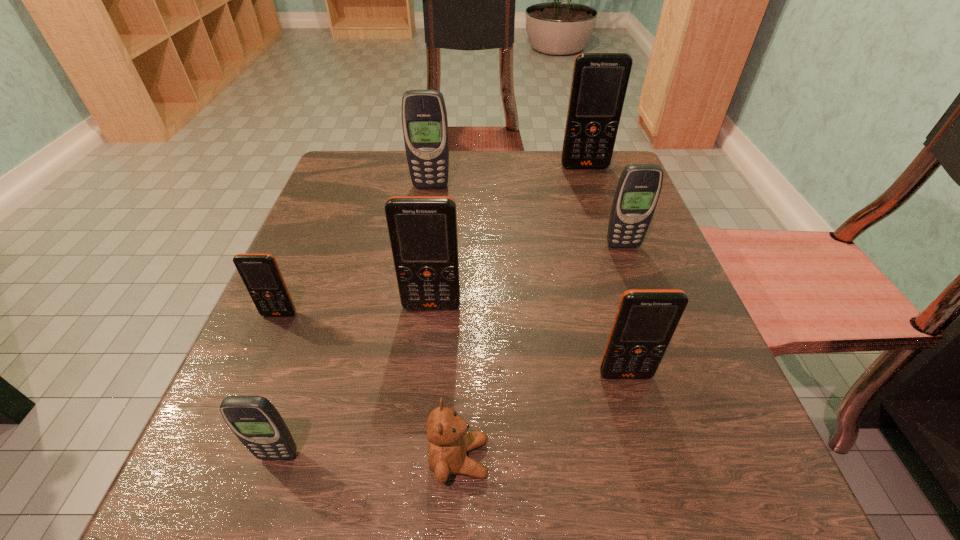
Find the location of `the leftmost cellular telephone`. the leftmost cellular telephone is located at coordinates (260, 273).

Find the location of a particular element. The image size is (960, 540). the nearest cellular telephone is located at coordinates (255, 421).

Identify the location of the nearest gray cellular telephone. (255, 421).

At what (x,y) coordinates should I click in order to perform the action: click on teddy bear. Please return your answer as a coordinate pair (x, y). The width and height of the screenshot is (960, 540). Looking at the image, I should click on (449, 441).

Locate an element on the screen. This screenshot has height=540, width=960. brown teddy bear is located at coordinates (449, 441).

The height and width of the screenshot is (540, 960). Find the location of `vacant area situated 0.160m on the screen of the tallest object`. vacant area situated 0.160m on the screen of the tallest object is located at coordinates 598,208.

You are a GUI agent. You are given a task and a screenshot of the screen. Output one action in this format:
    pyautogui.click(x=<x>, y=<y>)
    Task: Click on the free space located 0.190m on the screen of the third smallest orange cellular telephone
    
    Given the screenshot: What is the action you would take?
    pyautogui.click(x=420, y=413)

This screenshot has height=540, width=960. Find the location of `free space located on the screen of the biggest gray cellular telephone`. free space located on the screen of the biggest gray cellular telephone is located at coordinates (421, 251).

Where is `vacant space located 0.290m on the screen of the rightmost gray cellular telephone`? The height and width of the screenshot is (540, 960). vacant space located 0.290m on the screen of the rightmost gray cellular telephone is located at coordinates (668, 372).

Identify the location of vacant space situated 0.120m on the screen of the second nearest cellular telephone. The height and width of the screenshot is (540, 960). [x=649, y=461].